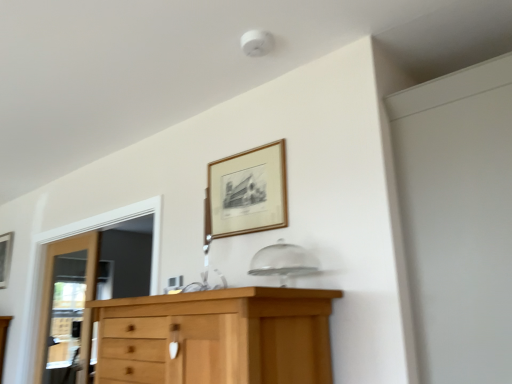
Question: Is the position of white matte screen door at upper right less distant than that of wooden picture frame at upper center, acting as the 2th picture frame starting from the bottom?

Choices:
 (A) yes
 (B) no

Answer: (A)

Question: Can you confirm if white matte screen door at upper right is smaller than wooden picture frame at upper center, acting as the 2th picture frame starting from the back?

Choices:
 (A) yes
 (B) no

Answer: (B)

Question: From the image's perspective, is white matte screen door at upper right located beneath wooden picture frame at upper center, acting as the 2th picture frame starting from the back?

Choices:
 (A) no
 (B) yes

Answer: (B)

Question: From the image's perspective, is white matte screen door at upper right over wooden picture frame at upper center, acting as the 2th picture frame starting from the back?

Choices:
 (A) no
 (B) yes

Answer: (A)

Question: Is white matte screen door at upper right positioned behind wooden picture frame at upper center, acting as the 2th picture frame starting from the bottom?

Choices:
 (A) yes
 (B) no

Answer: (B)

Question: Does white matte screen door at upper right contain wooden picture frame at upper center, acting as the 2th picture frame starting from the bottom?

Choices:
 (A) yes
 (B) no

Answer: (B)

Question: Considering the relative sizes of wooden picture frame at upper center, acting as the 2th picture frame starting from the back, and wooden picture frame at left, which appears as the 1th picture frame when viewed from the left, in the image provided, is wooden picture frame at upper center, acting as the 2th picture frame starting from the back, shorter than wooden picture frame at left, which appears as the 1th picture frame when viewed from the left,?

Choices:
 (A) no
 (B) yes

Answer: (B)

Question: From a real-world perspective, is wooden picture frame at upper center, the 1th picture frame from the top, located higher than wooden picture frame at left, which is the first picture frame in bottom-to-top order?

Choices:
 (A) no
 (B) yes

Answer: (B)

Question: Is wooden picture frame at upper center, acting as the 2th picture frame starting from the bottom, further to camera compared to wooden picture frame at left, which appears as the second picture frame when viewed from the front?

Choices:
 (A) yes
 (B) no

Answer: (B)

Question: Is wooden picture frame at upper center, which is the 1th picture frame in front-to-back order, taller than wooden picture frame at left, which appears as the 1th picture frame when viewed from the left?

Choices:
 (A) yes
 (B) no

Answer: (B)

Question: Is wooden picture frame at upper center, acting as the 2th picture frame starting from the left, to the right of wooden picture frame at left, which appears as the second picture frame when viewed from the front, from the viewer's perspective?

Choices:
 (A) yes
 (B) no

Answer: (A)

Question: Is wooden picture frame at upper center, the 1th picture frame from the top, outside of wooden picture frame at left, positioned as the 2th picture frame in top-to-bottom order?

Choices:
 (A) no
 (B) yes

Answer: (B)

Question: Is wooden picture frame at upper center, acting as the 2th picture frame starting from the back, outside of white matte screen door at upper right?

Choices:
 (A) yes
 (B) no

Answer: (A)